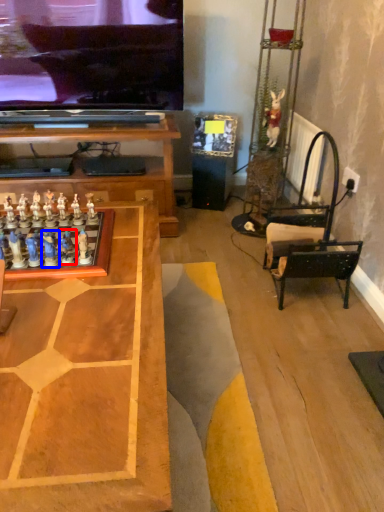
Question: Which object is further to the camera taking this photo, toy (highlighted by a red box) or toy (highlighted by a blue box)?

Choices:
 (A) toy
 (B) toy

Answer: (A)